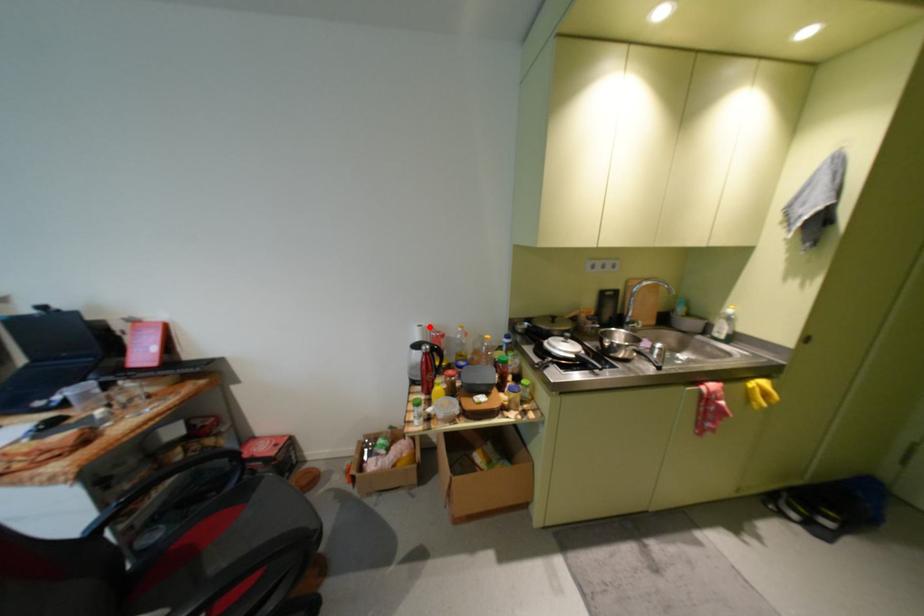
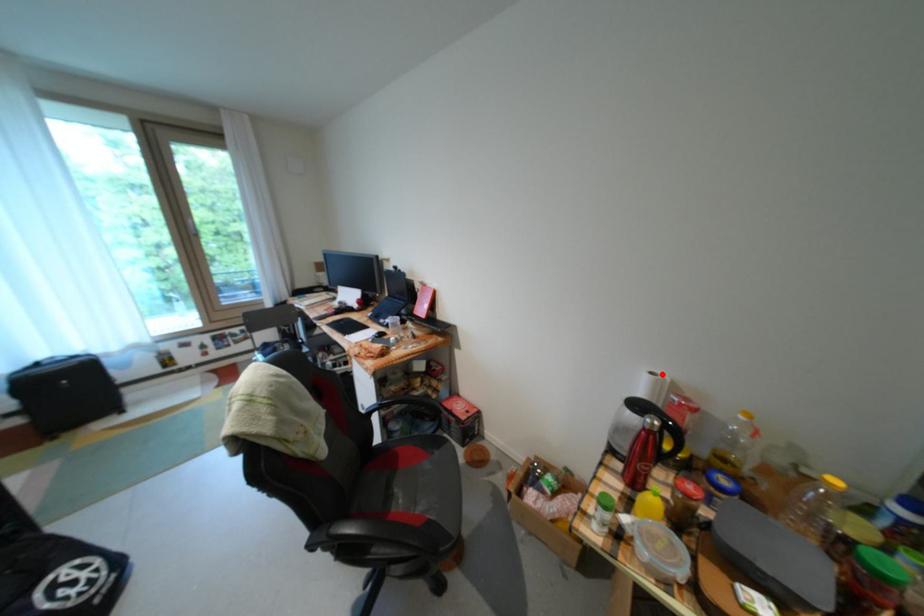
I am providing you with two images of the same scene from different viewpoints. A red point is marked on the first image and another point is marked on the second image. Are the points marked in image1 and image2 representing the same 3D position?

Yes